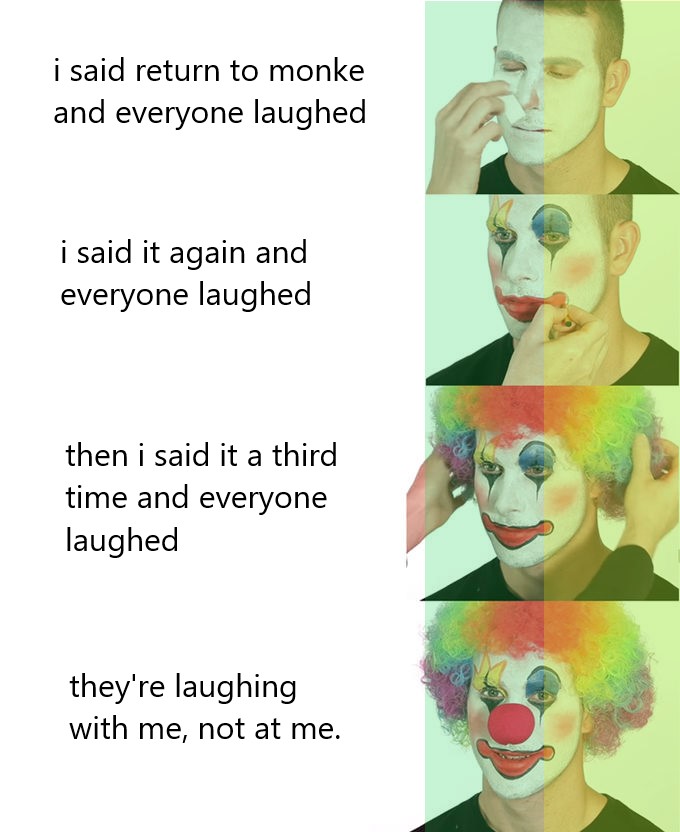
Identify the location of makeup brush. click(x=511, y=110).